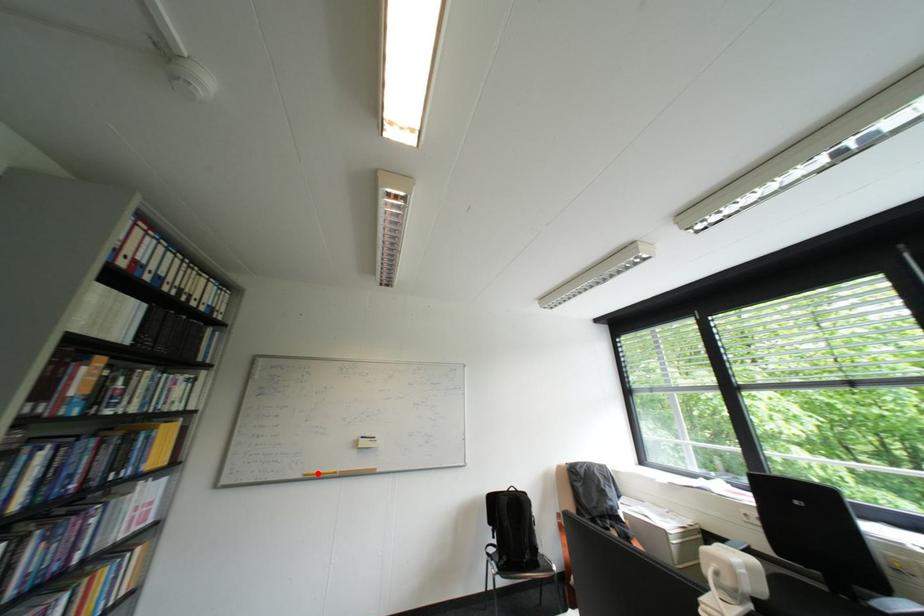
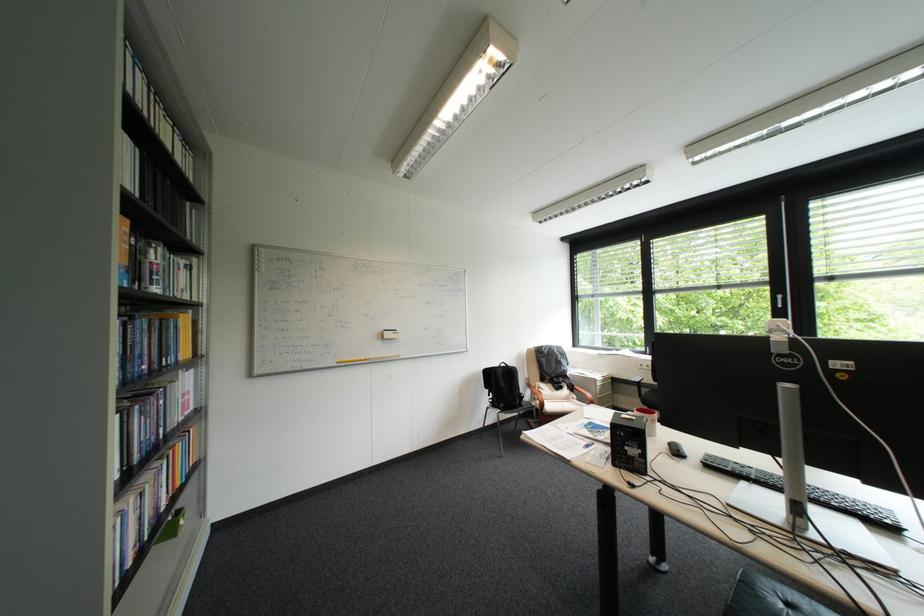
The point at the highlighted location is marked in the first image. Where is the corresponding point in the second image?

(350, 361)